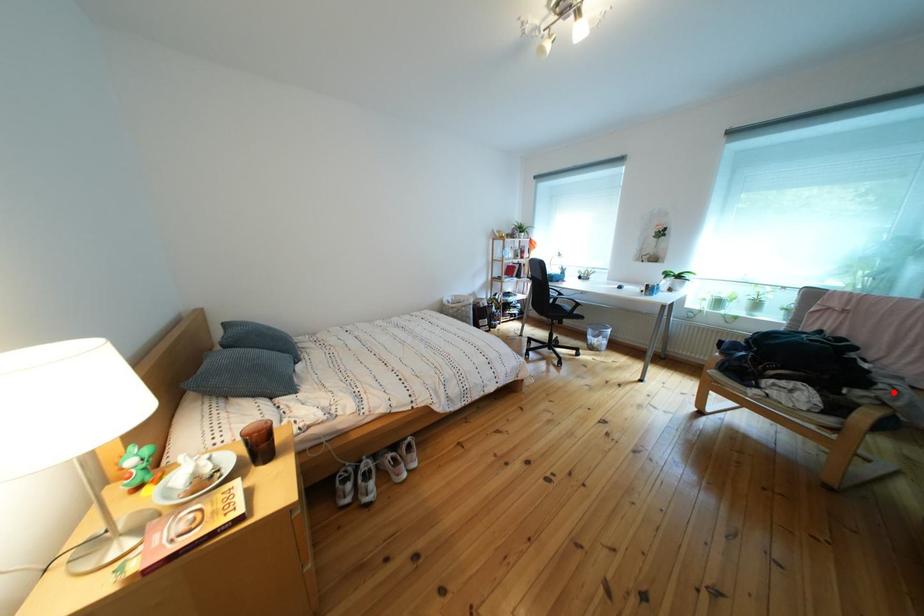
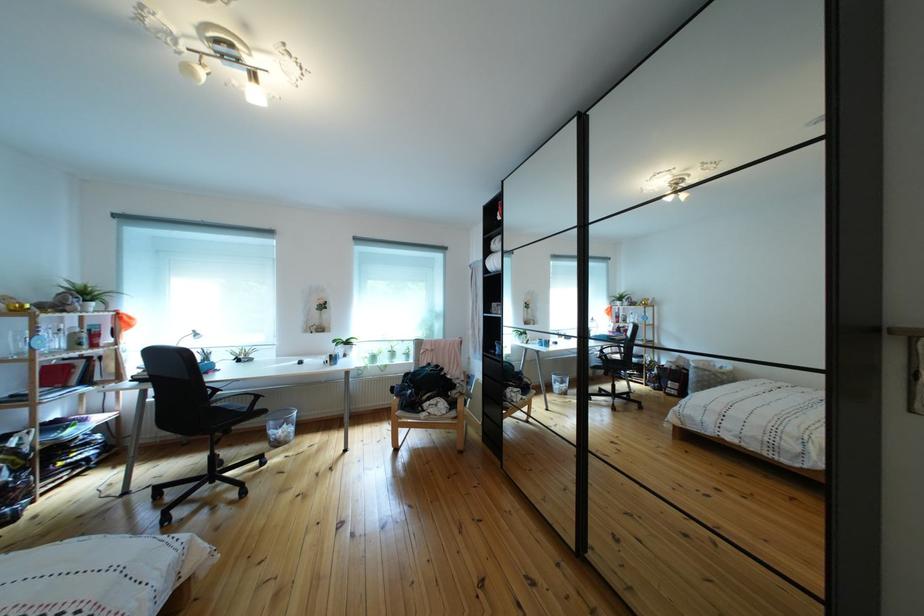
Question: I am providing you with two images of the same scene from different viewpoints. In image1, a red point is highlighted. Considering the same 3D point in image2, which of the following is correct?

Choices:
 (A) It is closer
 (B) It is farther

Answer: (B)